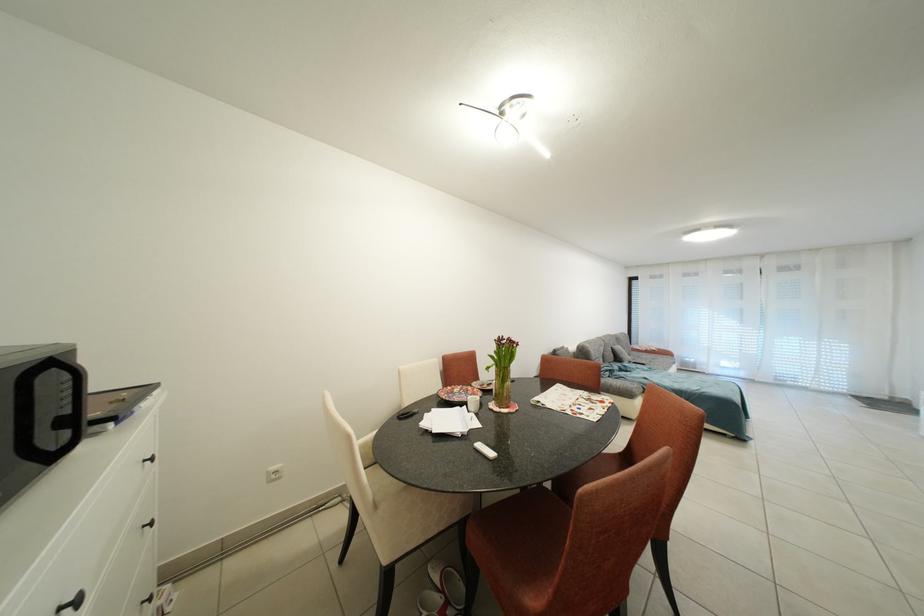
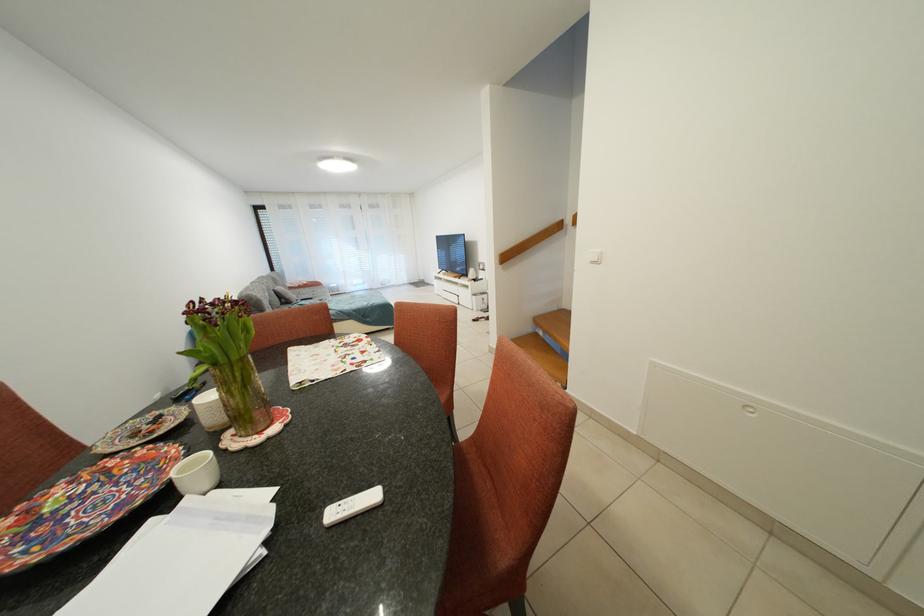
In the second image, find the point that corresponds to (x=478, y=392) in the first image.

(120, 467)